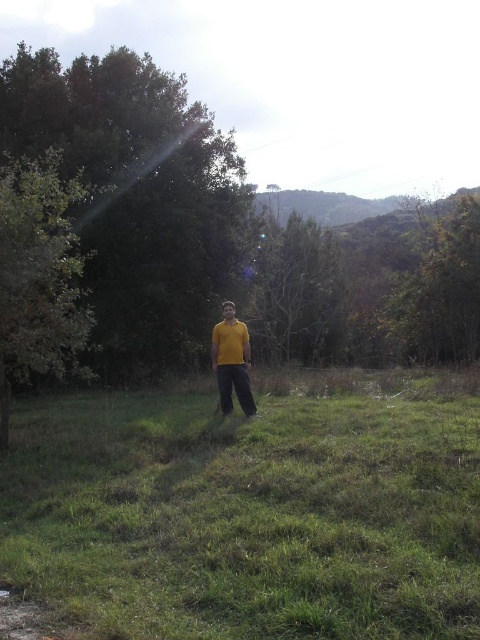
Question: Is green leafy tree at center smaller than yellow matte shirt at center?

Choices:
 (A) no
 (B) yes

Answer: (A)

Question: Is green grass at center bigger than green leafy tree at center?

Choices:
 (A) no
 (B) yes

Answer: (A)

Question: Which object appears closest to the camera in this image?

Choices:
 (A) green leafy tree at left
 (B) yellow matte shirt at center

Answer: (A)

Question: Can you confirm if green leafy tree at center is bigger than yellow matte shirt at center?

Choices:
 (A) no
 (B) yes

Answer: (B)

Question: Based on their relative distances, which object is nearer to the green leafy tree at left?

Choices:
 (A) green leafy tree at center
 (B) green grass at center

Answer: (B)

Question: Considering the real-world distances, which object is farthest from the green leafy tree at left?

Choices:
 (A) green leafy tree at center
 (B) green grass at center
 (C) yellow matte shirt at center

Answer: (A)